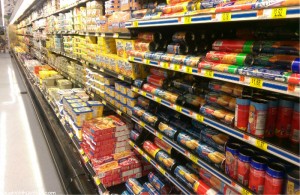
This screenshot has width=300, height=195. I want to click on shelves in this section, so click(x=78, y=3), click(x=75, y=33), click(x=76, y=60), click(x=71, y=78).